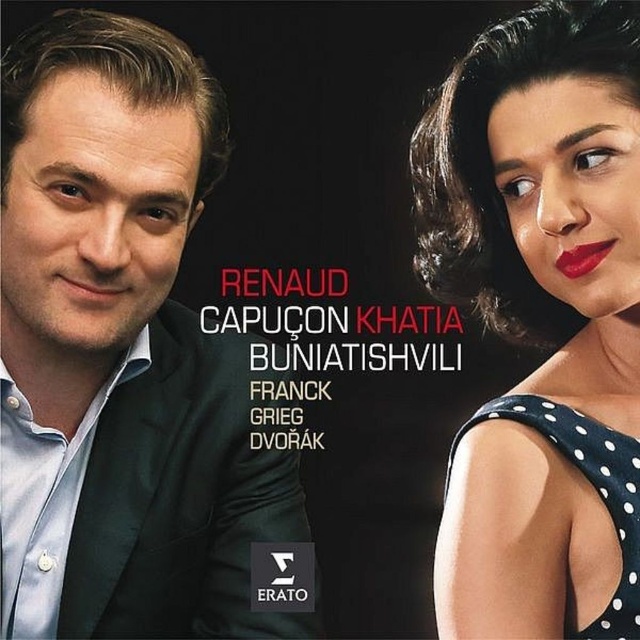
You are designing a poster and need to place a caption below the blue shirt at left and the black polka dot dress at upper right. Which object should the caption be placed closer to, and why?

The caption should be placed closer to the black polka dot dress at upper right because the blue shirt at left is much taller than the black polka dot dress at upper right, so the dress is lower and the caption needs to be near it to avoid overlapping with the taller shirt.

You are designing a layout for a magazine spread. You need to place a photo of the blue shirt at left and the matte red lipstick at upper right. Given their sizes, which object should be placed higher in the layout to maintain visual balance?

The blue shirt at left has a greater height compared to the matte red lipstick at upper right, so placing the blue shirt at left higher in the layout would help maintain visual balance by compensating for its larger size.